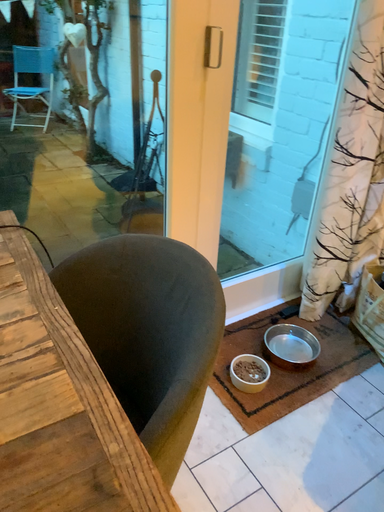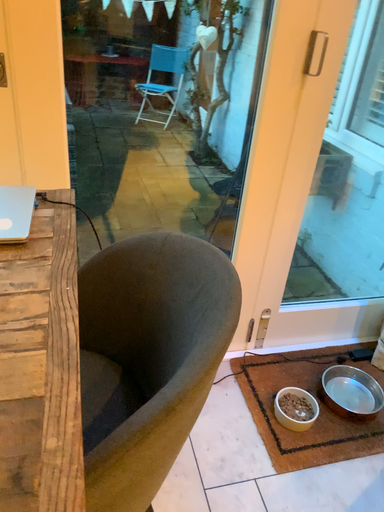
Question: How did the camera likely rotate when shooting the video?

Choices:
 (A) rotated right
 (B) rotated left

Answer: (B)